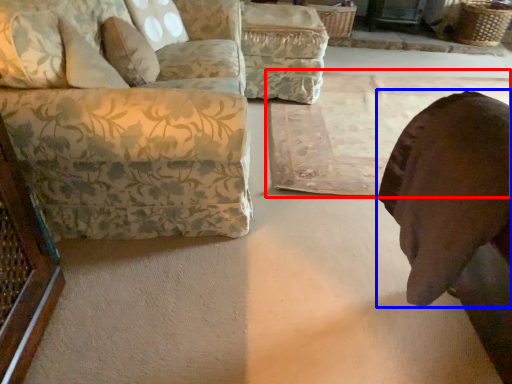
Question: Which of the following is the farthest to the observer, mat (highlighted by a red box) or animal (highlighted by a blue box)?

Choices:
 (A) mat
 (B) animal

Answer: (A)